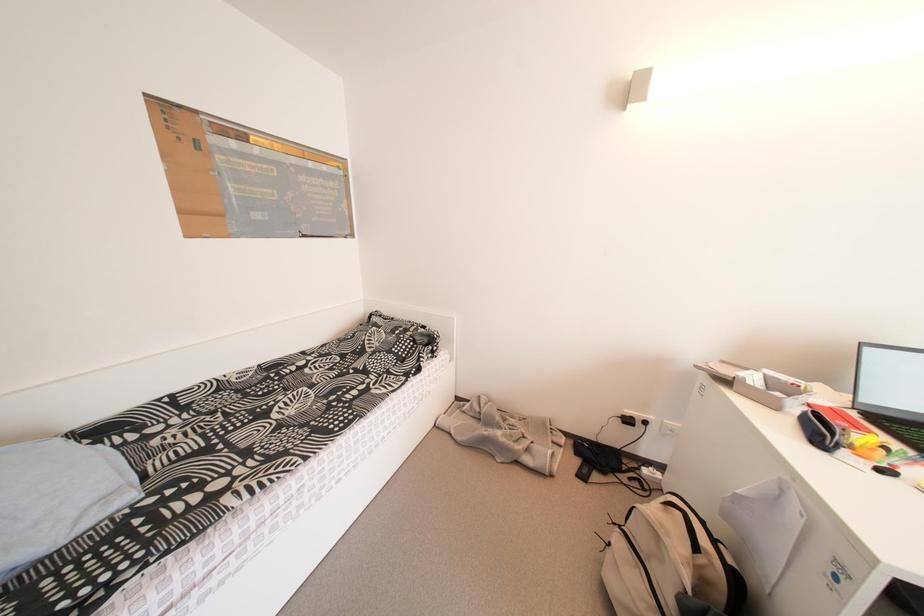
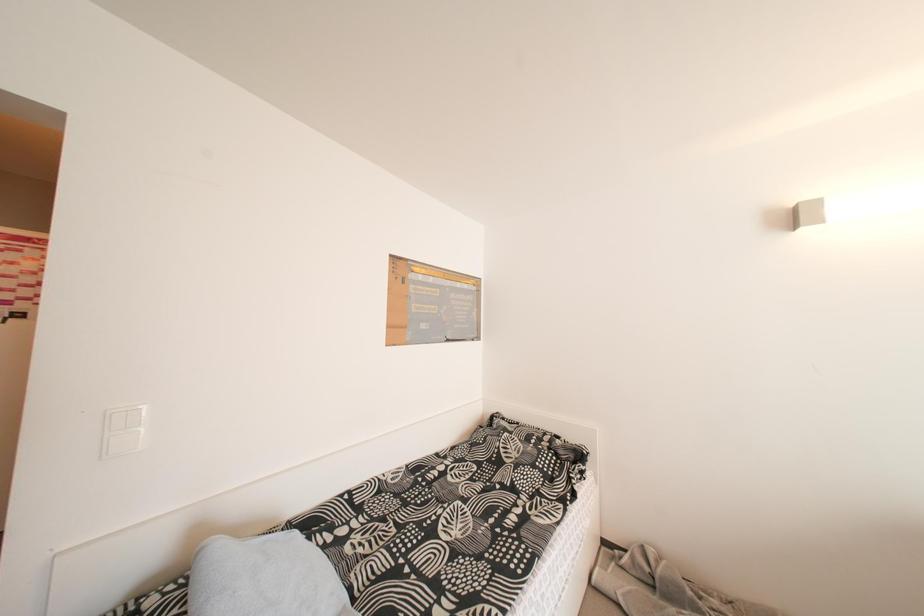
Question: Based on the continuous images, in which direction is the camera rotating? Reply with the corresponding letter.

Choices:
 (A) Left
 (B) Right
 (C) Up
 (D) Down

Answer: (C)